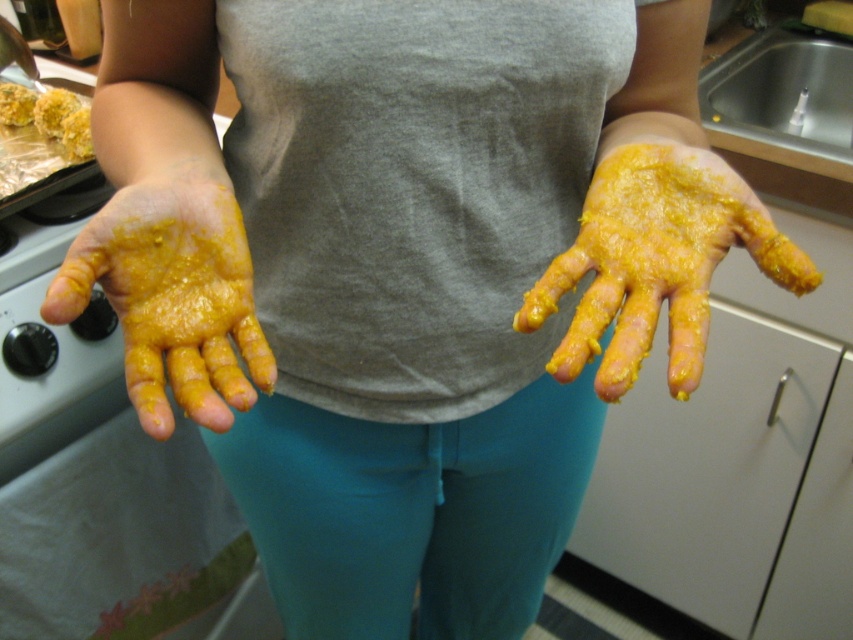
Does yellow matte hand at center have a smaller size compared to yellow crumbly food at left?

No, yellow matte hand at center is not smaller than yellow crumbly food at left.

Does yellow matte hand at center lie in front of yellow crumbly food at left?

Yes, it is.

You are a GUI agent. You are given a task and a screenshot of the screen. Output one action in this format:
    pyautogui.click(x=<x>, y=<y>)
    Task: Click on the yellow matte hand at center
    This screenshot has height=640, width=853.
    Given the screenshot: What is the action you would take?
    pyautogui.click(x=654, y=262)

The width and height of the screenshot is (853, 640). Find the location of `yellow matte hand at center`. yellow matte hand at center is located at coordinates (654, 262).

Between point (155, 291) and point (54, 113), which one is positioned behind?

Positioned behind is point (54, 113).

Does yellow matte hand at left have a lesser width compared to yellow crumbly food at left?

No, yellow matte hand at left is not thinner than yellow crumbly food at left.

Is point (136, 269) positioned in front of point (56, 120)?

Yes, point (136, 269) is in front of point (56, 120).

You are a GUI agent. You are given a task and a screenshot of the screen. Output one action in this format:
    pyautogui.click(x=<x>, y=<y>)
    Task: Click on the yellow matte hand at left
    
    Given the screenshot: What is the action you would take?
    pyautogui.click(x=172, y=300)

Can you confirm if yellow matte hand at left is shorter than yellow crumbly food at upper left?

No.

Does yellow matte hand at left appear on the right side of yellow crumbly food at upper left?

Yes, yellow matte hand at left is to the right of yellow crumbly food at upper left.

Is point (111, 273) closer to viewer compared to point (21, 92)?

Yes.

Where is `yellow matte hand at left`? The height and width of the screenshot is (640, 853). yellow matte hand at left is located at coordinates (172, 300).